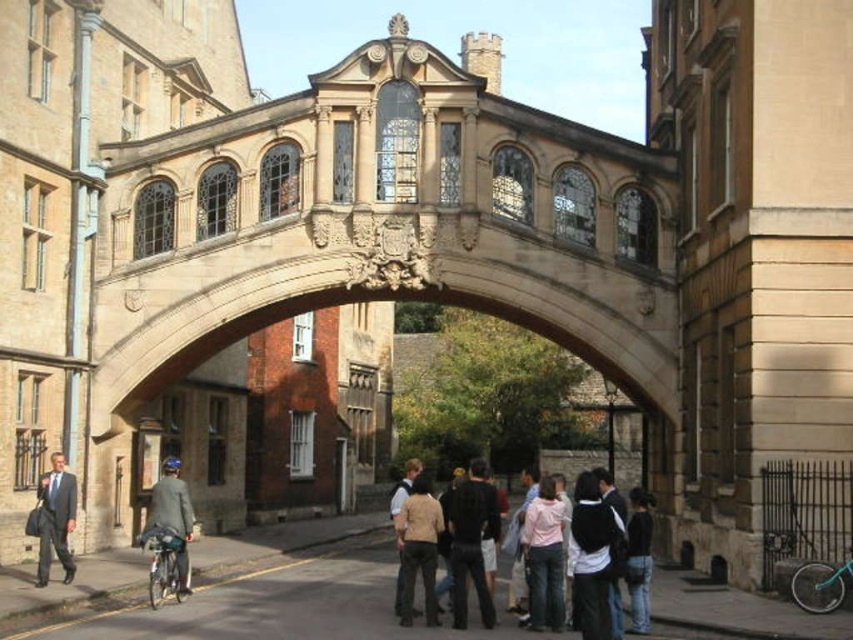
Looking at this image, you are an art student analyzing the composition of the Bridge of Sighs in Oxford. You notice two figures in the foreground wearing a light brown leather jacket at lower center and a matte gray suit at lower left. Which figure is positioned closer to the base of the bridge?

The light brown leather jacket at lower center is positioned closer to the base of the bridge because it is located below the matte gray suit at lower left, indicating it is lower in the scene.

You are a photographer planning to take a portrait of two people wearing the tan fabric jacket at center and the matte black suit at left. To ensure both subjects are in frame, which subject should you position closer to the camera to maintain proportional visibility?

The tan fabric jacket at center should be positioned closer to the camera since it has a smaller size compared to the matte black suit at left, ensuring both appear proportionally visible in the photograph.

You are a photographer standing on the Bridge of Sighs in Oxford. You notice a light brown leather jacket at lower center and a matte black suit at left. Which object is located to the right of the other?

The light brown leather jacket at lower center is positioned on the right side of the matte black suit at left.